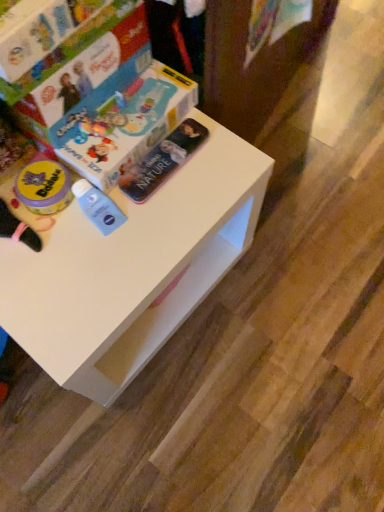
Question: Visually, is metallic silver book at center, positioned as the 2th paperback book in top-to-bottom order, positioned to the left or to the right of hardcover book at upper left, which is the first paperback book from top to bottom?

Choices:
 (A) left
 (B) right

Answer: (B)

Question: From a real-world perspective, is metallic silver book at center, positioned as the 2th paperback book in top-to-bottom order, above or below hardcover book at upper left, the second paperback book ordered from the bottom?

Choices:
 (A) above
 (B) below

Answer: (B)

Question: Considering the real-world distances, which object is farthest from the metallic silver book at center, positioned as the 2th paperback book in top-to-bottom order?

Choices:
 (A) white matte table at center
 (B) hardcover book at upper left, the second paperback book ordered from the bottom

Answer: (A)

Question: Which object is positioned closest to the metallic silver book at center, marked as the 1th paperback book in a bottom-to-top arrangement?

Choices:
 (A) hardcover book at upper left, which is the first paperback book from top to bottom
 (B) white matte table at center

Answer: (A)